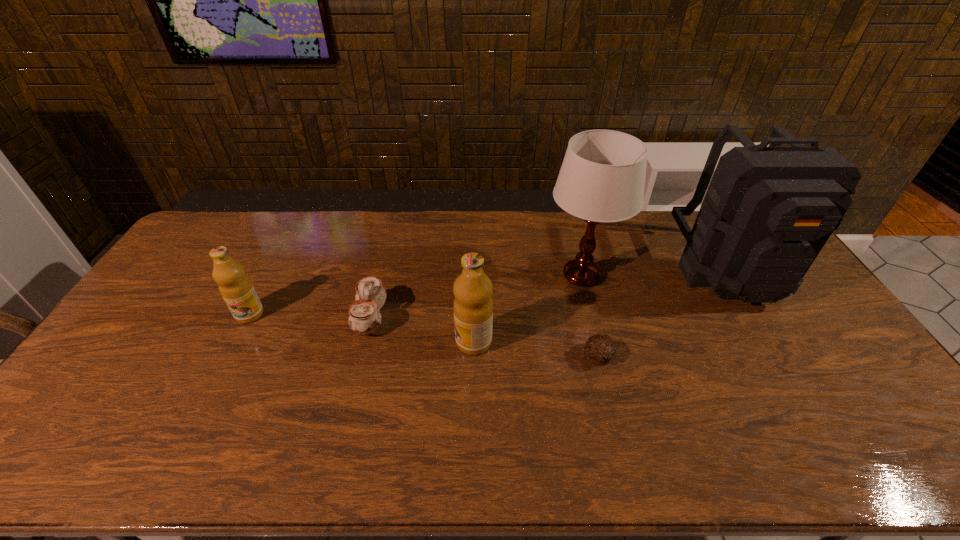
Select which object appears as the fourth closest to the left olive oil. Please provide its 2D coordinates. Your answer should be formatted as a tuple, i.e. [(x, y)], where the tuple contains the x and y coordinates of a point satisfying the conditions above.

[(600, 349)]

I want to click on vacant space that satisfies the following two spatial constraints: 1. on the label of the leftmost object; 2. on the left side of the muffin, so click(228, 356).

I want to click on vacant area in the image that satisfies the following two spatial constraints: 1. by the handle of the second object from left to right; 2. on the left side of the shortest object, so click(x=361, y=356).

The height and width of the screenshot is (540, 960). In order to click on vacant region that satisfies the following two spatial constraints: 1. by the handle of the second shortest object; 2. on the left side of the shortest object in this screenshot , I will do `click(361, 356)`.

Identify the location of free space that satisfies the following two spatial constraints: 1. on the front compartment of the backpack; 2. on the label of the taller olive oil. The image size is (960, 540). (775, 342).

Locate an element on the screen. Image resolution: width=960 pixels, height=540 pixels. free space that satisfies the following two spatial constraints: 1. on the label of the leftmost object; 2. on the left side of the shortest object is located at coordinates (228, 356).